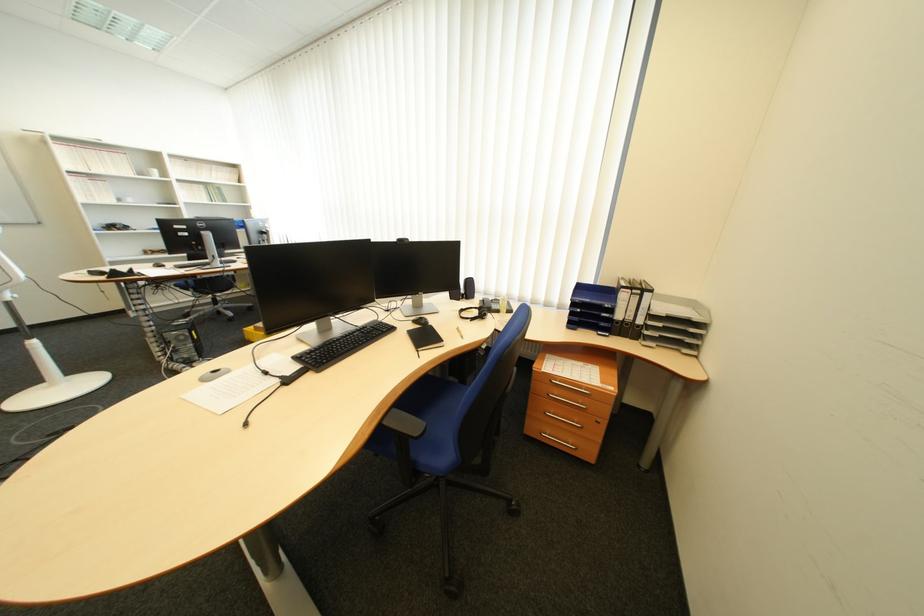
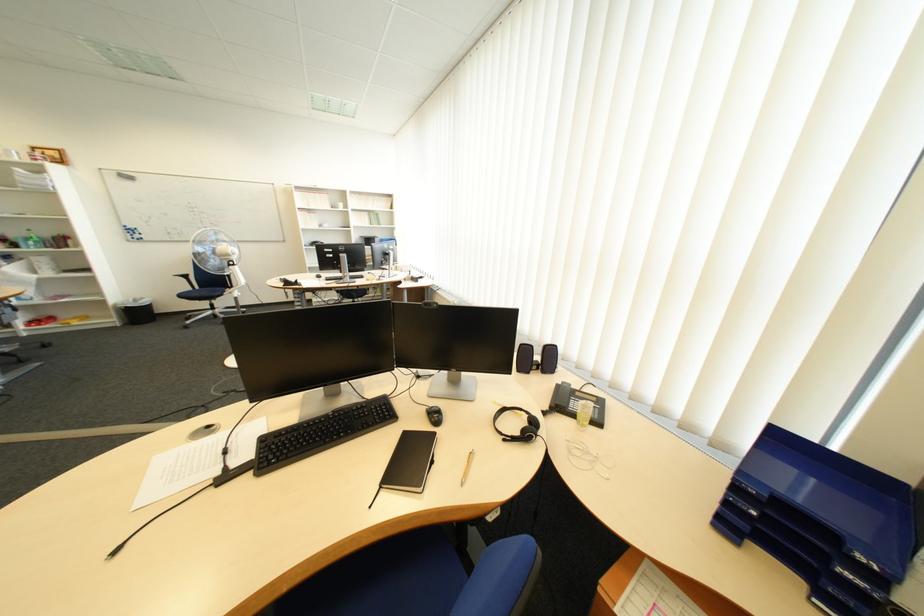
Where in the second image is the point corresponding to pixel 432 351 from the first image?

(396, 488)